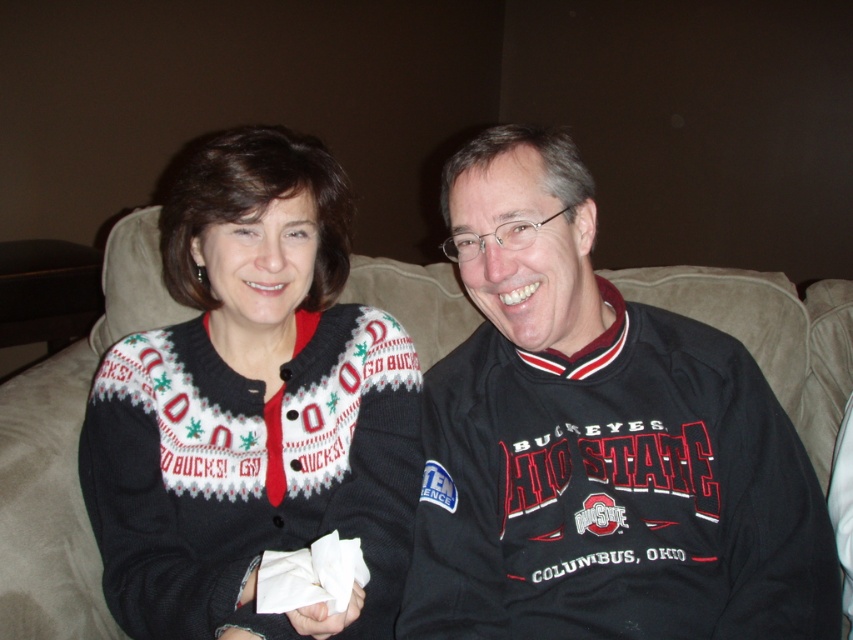
You are a photographer standing in front of the knit sweater at center. You want to take a clear photo of it without any blur. What is the minimum distance you should maintain to ensure the sweater is in focus?

The minimum distance you should maintain to ensure the knit sweater at center is in focus is 31.97 inches, as that is the distance between the viewer and the knit sweater at center.

You are a photographer trying to capture the perfect shot of the black jersey at center and the suede couch at center. Based on the scene, which object is positioned higher in the image?

The black jersey at center is located above the suede couch at center, so it is positioned higher in the image.

In the scene shown: Where is the black jersey at center located in the image?

The black jersey at center is located at point coordinates 0.691 on the x axis and 0.702 on the y axis.